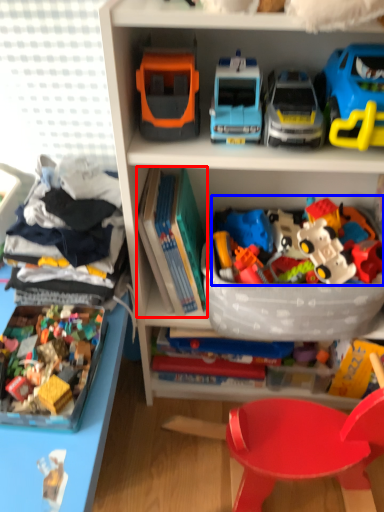
Question: Which object appears closest to the camera in this image, book (highlighted by a red box) or toy (highlighted by a blue box)?

Choices:
 (A) book
 (B) toy

Answer: (B)